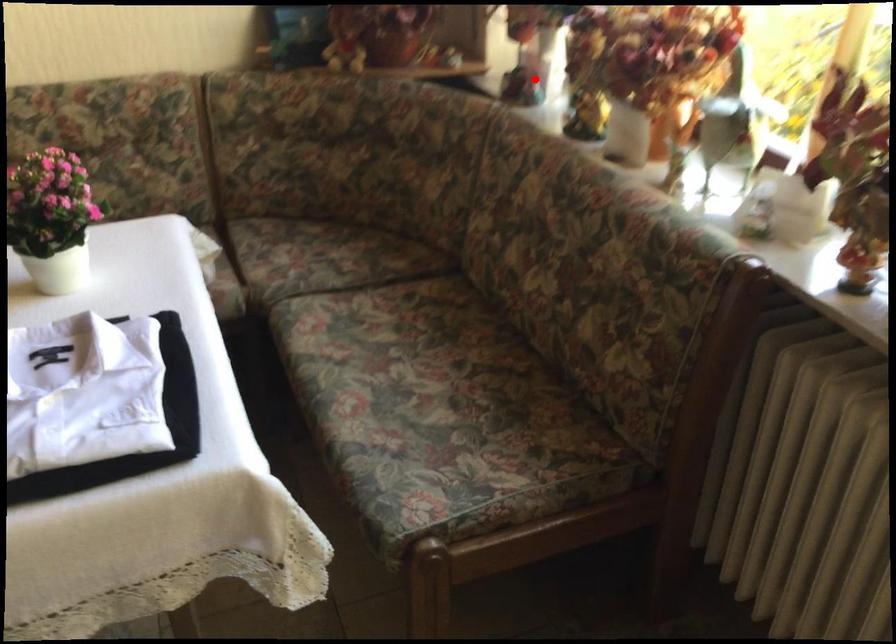
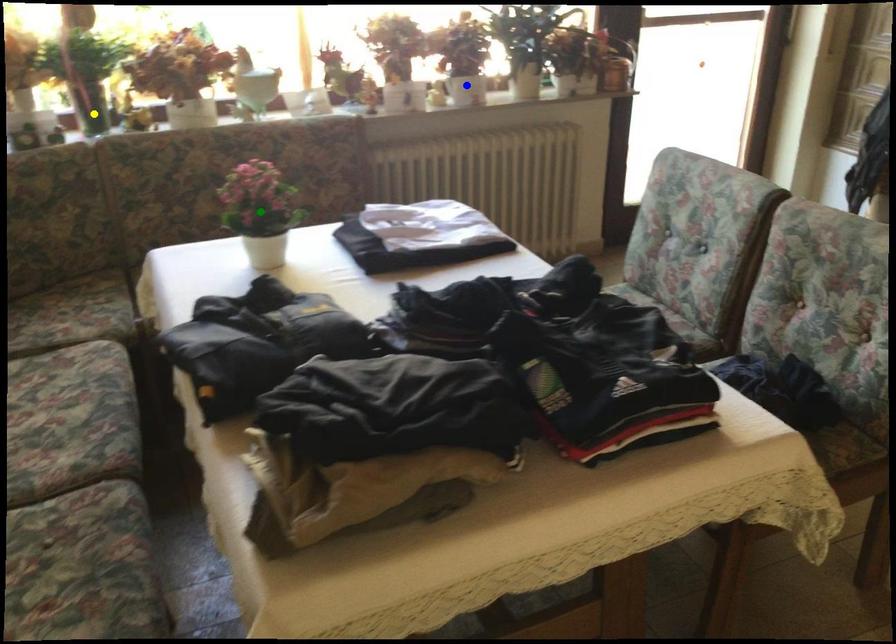
Question: I am providing you with two images of the same scene from different viewpoints. A red point is marked on the first image. You are given multiple points on the second image. Which point in image 2 represents the same 3d spot as the red point in image 1?

Choices:
 (A) green point
 (B) blue point
 (C) yellow point

Answer: (C)